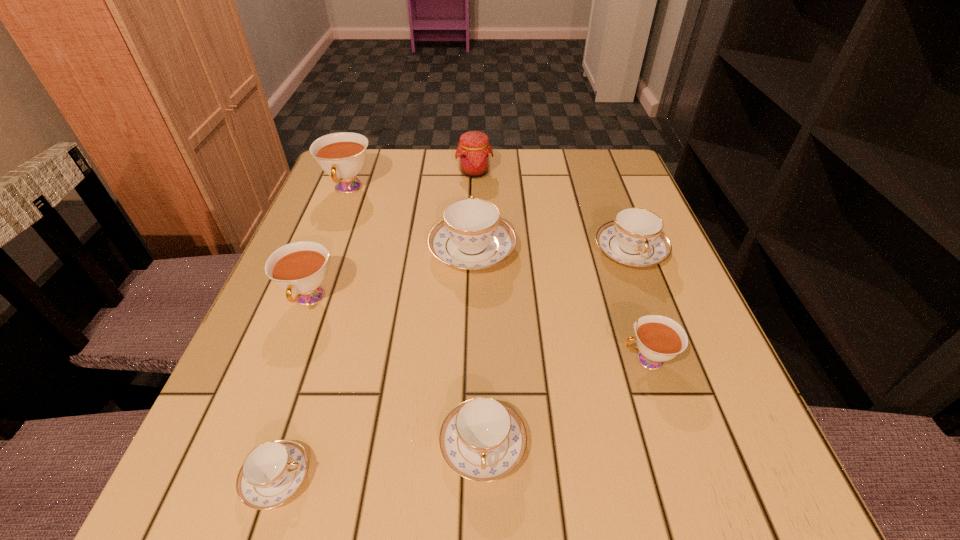
The image size is (960, 540). What are the coordinates of `the sixth closest object to the smallest blue teacup` in the screenshot? It's located at (342, 155).

Point out which object is positioned as the fourth nearest to the biggest blue teacup. Please provide its 2D coordinates. Your answer should be formatted as a tuple, i.e. [(x, y)], where the tuple contains the x and y coordinates of a point satisfying the conditions above.

[(474, 152)]

Identify the location of teacup that can be found as the fifth closest to the third biggest blue teacup. Image resolution: width=960 pixels, height=540 pixels. (635, 237).

Find the location of a particular element. The width and height of the screenshot is (960, 540). the fourth closest teacup to the rightmost blue teacup is located at coordinates (299, 267).

Identify the location of the second closest white teacup to the shortest object. (659, 338).

This screenshot has height=540, width=960. Find the location of `the second closest white teacup to the second farthest white teacup`. the second closest white teacup to the second farthest white teacup is located at coordinates (659, 338).

Find the location of a particular element. The height and width of the screenshot is (540, 960). blue teacup object that ranks as the second closest to the smallest blue teacup is located at coordinates (471, 236).

Find the location of `blue teacup that stands as the second closest to the red jam`. blue teacup that stands as the second closest to the red jam is located at coordinates (635, 237).